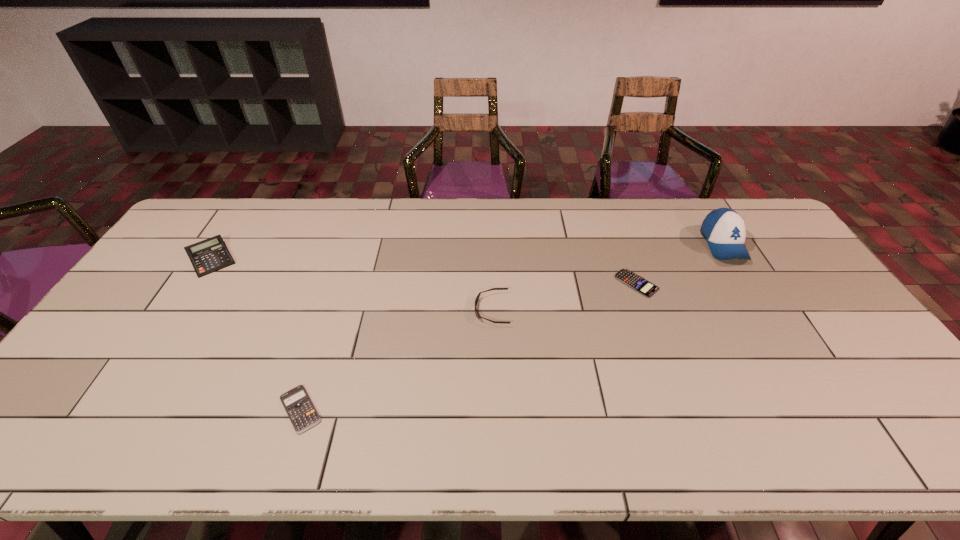
Locate an element on the screen. The image size is (960, 540). object that is at the far right corner is located at coordinates (724, 229).

The width and height of the screenshot is (960, 540). Identify the location of vacant space at the far edge of the desktop. (661, 227).

This screenshot has height=540, width=960. I want to click on free region at the near edge, so click(x=725, y=422).

This screenshot has width=960, height=540. Find the location of `free space at the left edge of the desktop`. free space at the left edge of the desktop is located at coordinates (172, 256).

The height and width of the screenshot is (540, 960). In order to click on free spot at the right edge of the desktop in this screenshot , I will do `click(854, 420)`.

Locate an element on the screen. This screenshot has height=540, width=960. free space at the far right corner of the desktop is located at coordinates (770, 225).

Where is `free space between the tallest calculator and the third shortest object`? This screenshot has height=540, width=960. free space between the tallest calculator and the third shortest object is located at coordinates (351, 284).

The image size is (960, 540). I want to click on vacant region between the fourth object from left to right and the fourth object from right to left, so click(468, 346).

The height and width of the screenshot is (540, 960). Identify the location of free area in between the nearest calculator and the second object from right to left. (468, 346).

The height and width of the screenshot is (540, 960). Identify the location of free space between the tallest object and the rightmost calculator. (680, 264).